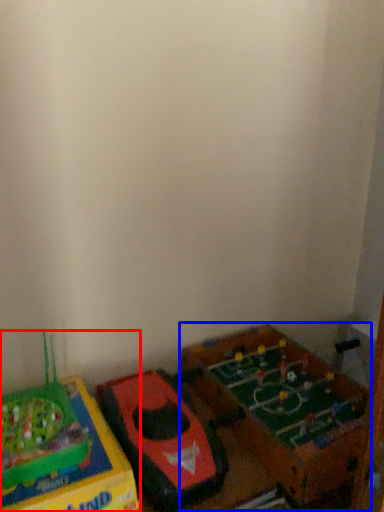
Question: Which of the following is the farthest to the observer, toy (highlighted by a red box) or toy (highlighted by a blue box)?

Choices:
 (A) toy
 (B) toy

Answer: (B)